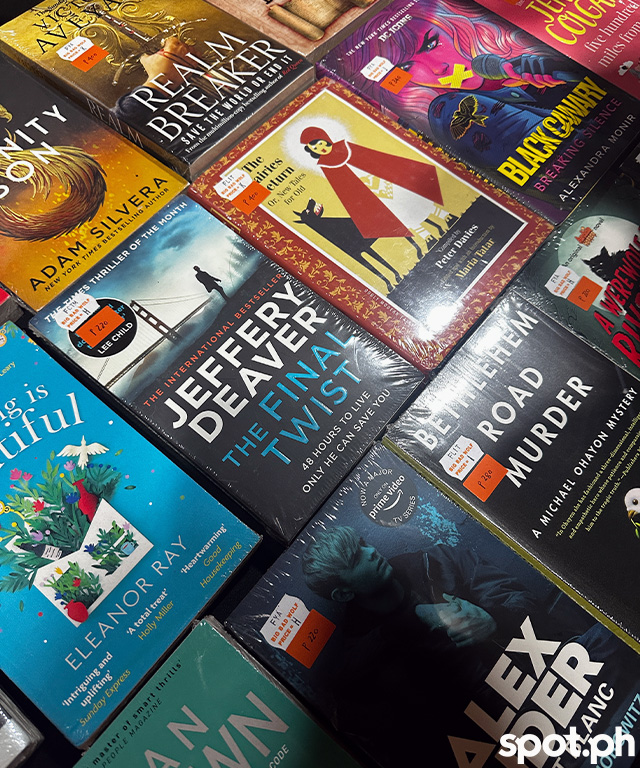
This screenshot has height=768, width=640. Find the location of `book`. book is located at coordinates (445, 696).